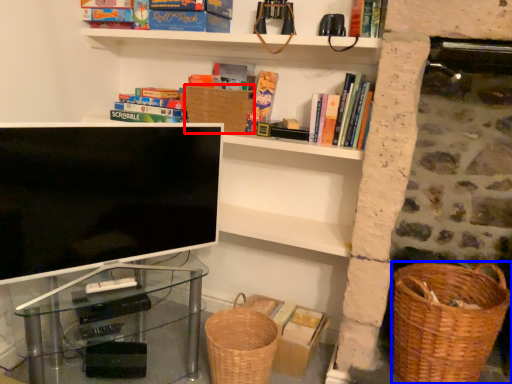
Question: Which point is further to the camera, basket (highlighted by a red box) or basket container (highlighted by a blue box)?

Choices:
 (A) basket
 (B) basket container

Answer: (A)